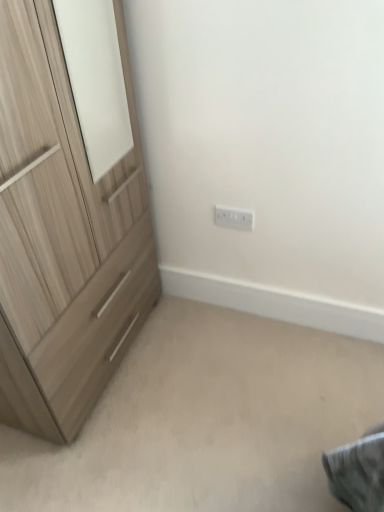
Question: Is white plastic electric outlet at center wider than light wood/texture chest of drawers at left?

Choices:
 (A) yes
 (B) no

Answer: (B)

Question: Is white plastic electric outlet at center touching light wood/texture chest of drawers at left?

Choices:
 (A) yes
 (B) no

Answer: (B)

Question: Can you confirm if white plastic electric outlet at center is smaller than light wood/texture chest of drawers at left?

Choices:
 (A) no
 (B) yes

Answer: (B)

Question: Is white plastic electric outlet at center facing towards light wood/texture chest of drawers at left?

Choices:
 (A) yes
 (B) no

Answer: (B)

Question: Can you confirm if white plastic electric outlet at center is positioned to the left of light wood/texture chest of drawers at left?

Choices:
 (A) no
 (B) yes

Answer: (A)

Question: Is white plastic electric outlet at center not within light wood/texture chest of drawers at left?

Choices:
 (A) yes
 (B) no

Answer: (A)

Question: Is light wood/texture chest of drawers at left not near white plastic electric outlet at center?

Choices:
 (A) yes
 (B) no

Answer: (B)

Question: Is light wood/texture chest of drawers at left smaller than white plastic electric outlet at center?

Choices:
 (A) no
 (B) yes

Answer: (A)

Question: From a real-world perspective, is light wood/texture chest of drawers at left located beneath white plastic electric outlet at center?

Choices:
 (A) no
 (B) yes

Answer: (A)

Question: Considering the relative sizes of light wood/texture chest of drawers at left and white plastic electric outlet at center in the image provided, is light wood/texture chest of drawers at left shorter than white plastic electric outlet at center?

Choices:
 (A) no
 (B) yes

Answer: (A)

Question: Could you tell me if light wood/texture chest of drawers at left is facing white plastic electric outlet at center?

Choices:
 (A) yes
 (B) no

Answer: (A)

Question: Is light wood/texture chest of drawers at left at the left side of white plastic electric outlet at center?

Choices:
 (A) no
 (B) yes

Answer: (B)

Question: Based on their positions, is white plastic electric outlet at center located to the left or right of light wood/texture chest of drawers at left?

Choices:
 (A) right
 (B) left

Answer: (A)